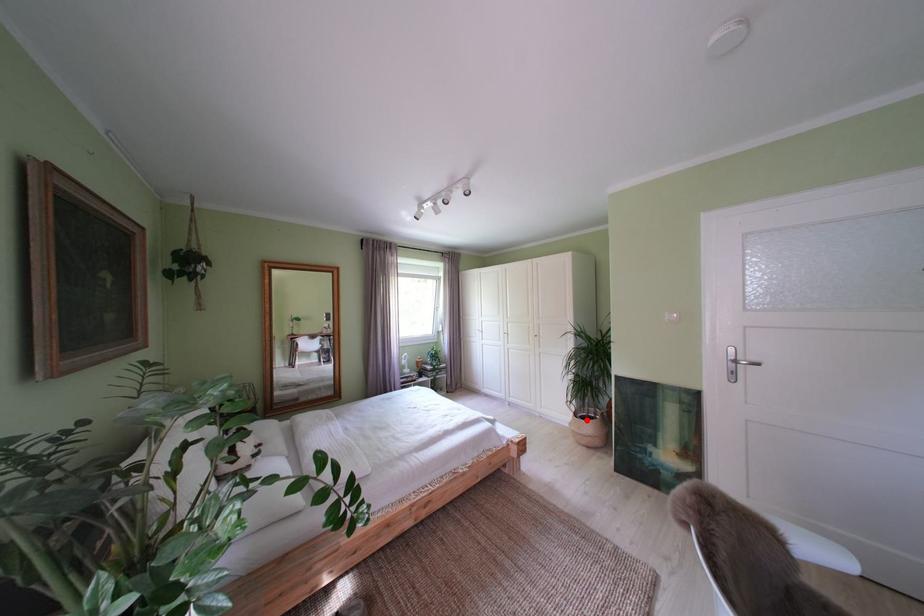
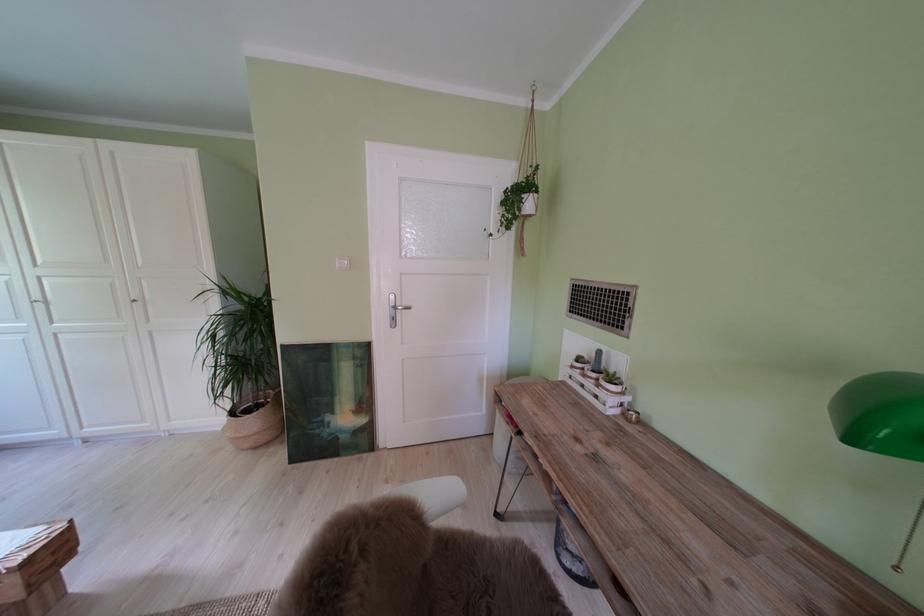
In the second image, find the point that corresponds to the highlighted location in the first image.

(242, 418)